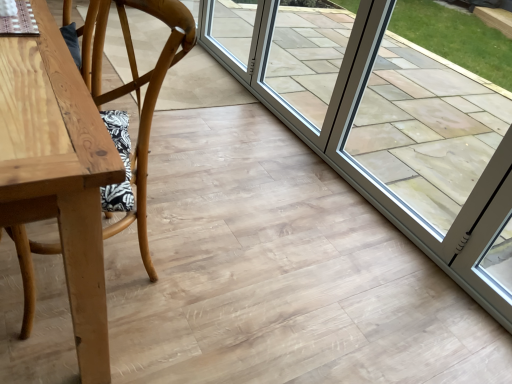
Question: Is wooden chair at left at the back of transparent glass door at right?

Choices:
 (A) no
 (B) yes

Answer: (A)

Question: Is transparent glass door at right not within wooden chair at left?

Choices:
 (A) no
 (B) yes

Answer: (B)

Question: Is transparent glass door at right at the right side of wooden chair at left?

Choices:
 (A) no
 (B) yes

Answer: (B)

Question: From a real-world perspective, is transparent glass door at right on wooden chair at left?

Choices:
 (A) yes
 (B) no

Answer: (A)

Question: From the image's perspective, is transparent glass door at right below wooden chair at left?

Choices:
 (A) no
 (B) yes

Answer: (A)

Question: In terms of size, does wooden chair at left appear bigger or smaller than clear glass door at center?

Choices:
 (A) small
 (B) big

Answer: (B)

Question: In terms of height, does wooden chair at left look taller or shorter compared to clear glass door at center?

Choices:
 (A) tall
 (B) short

Answer: (A)

Question: From the image's perspective, is wooden chair at left located above or below clear glass door at center?

Choices:
 (A) below
 (B) above

Answer: (A)

Question: Considering the positions of wooden chair at left and clear glass door at center in the image, is wooden chair at left wider or thinner than clear glass door at center?

Choices:
 (A) wide
 (B) thin

Answer: (A)

Question: Is clear glass door at center taller or shorter than wooden chair at left?

Choices:
 (A) short
 (B) tall

Answer: (A)

Question: Considering their positions, is clear glass door at center located in front of or behind wooden chair at left?

Choices:
 (A) front
 (B) behind

Answer: (B)

Question: Is clear glass door at center wider or thinner than wooden chair at left?

Choices:
 (A) wide
 (B) thin

Answer: (B)

Question: From the image's perspective, is clear glass door at center above or below wooden chair at left?

Choices:
 (A) below
 (B) above

Answer: (B)

Question: From the image's perspective, is transparent glass door at right above or below wooden chair at left?

Choices:
 (A) below
 (B) above

Answer: (B)

Question: Looking at their shapes, would you say transparent glass door at right is wider or thinner than wooden chair at left?

Choices:
 (A) thin
 (B) wide

Answer: (A)